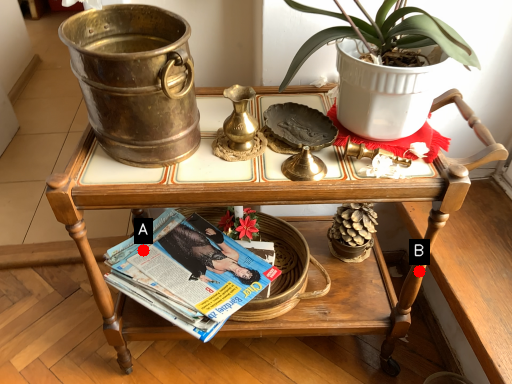
Question: Two points are circled on the image, labeled by A and B beside each circle. Which point appears closest to the camera in this image?

Choices:
 (A) A is closer
 (B) B is closer

Answer: (B)